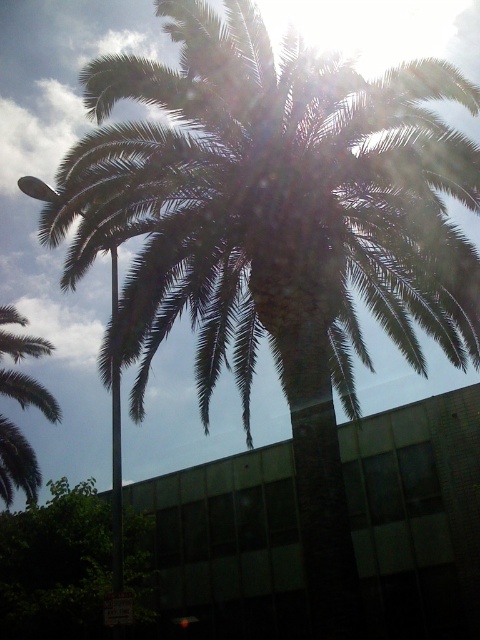
Is green leafy tree at lower left taller than green leafy palm at upper left?

No, green leafy tree at lower left is not taller than green leafy palm at upper left.

Who is more distant from viewer, (85, 634) or (38, 384)?

Positioned behind is point (38, 384).

This screenshot has height=640, width=480. In order to click on green leafy tree at lower left in this screenshot , I will do `click(56, 564)`.